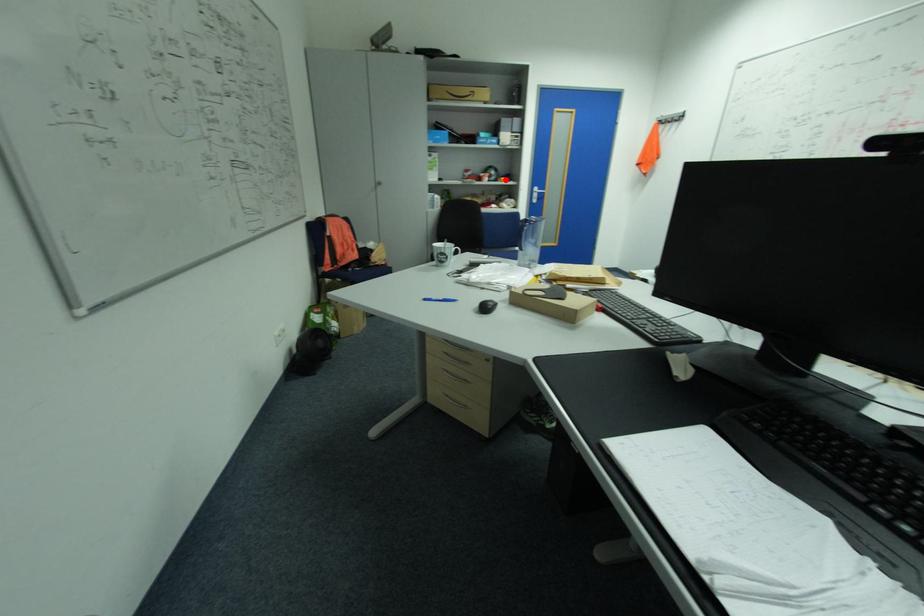
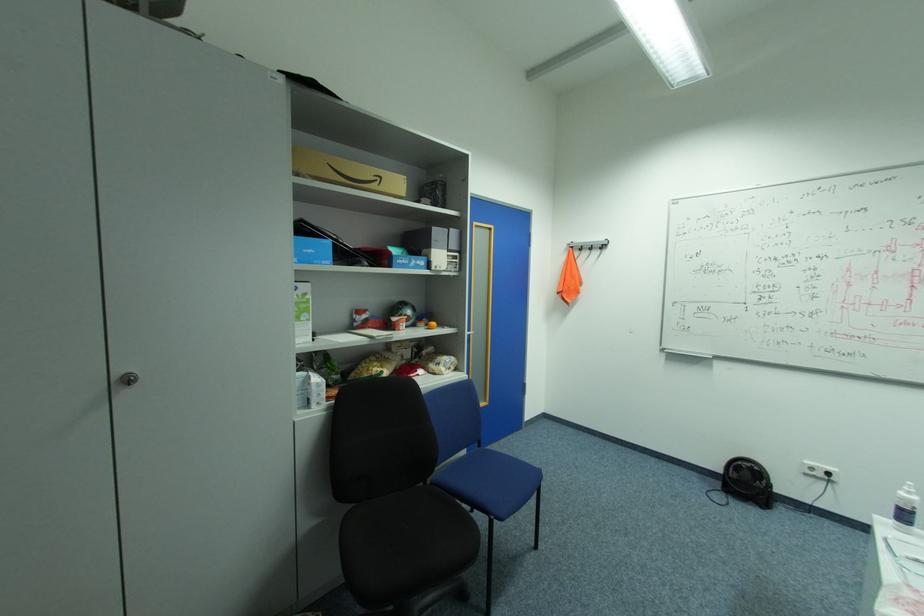
In the second image, find the point that corresponds to the highlighted location in the first image.

(429, 323)